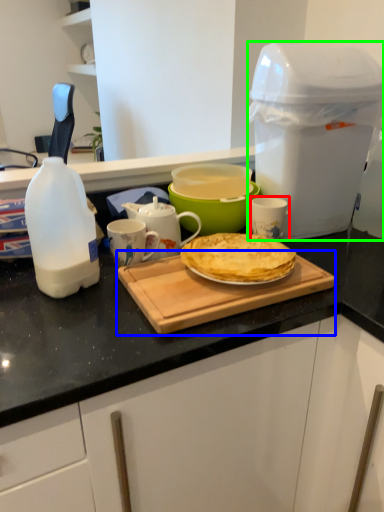
Question: Based on their relative distances, which object is nearer to mug (highlighted by a red box)? Choose from cutting board (highlighted by a blue box) and appliance (highlighted by a green box).

Choices:
 (A) cutting board
 (B) appliance

Answer: (B)